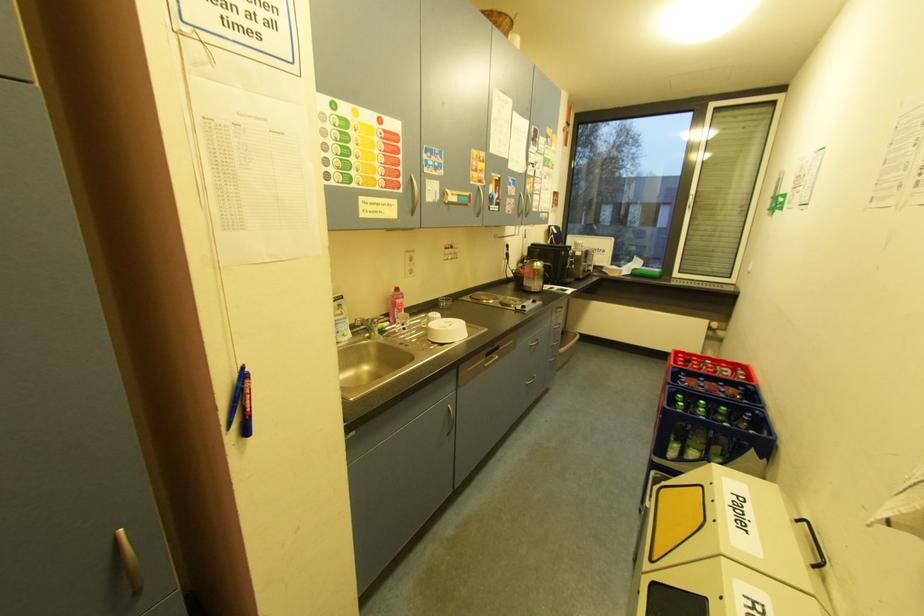
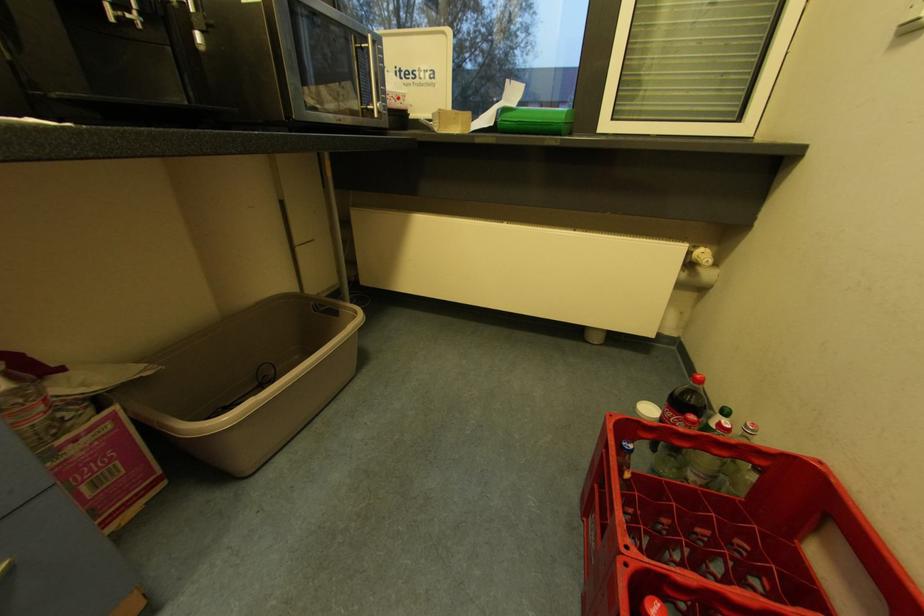
The images are taken continuously from a first-person perspective. In which direction are you moving?

The cameraman walked toward right, forward.